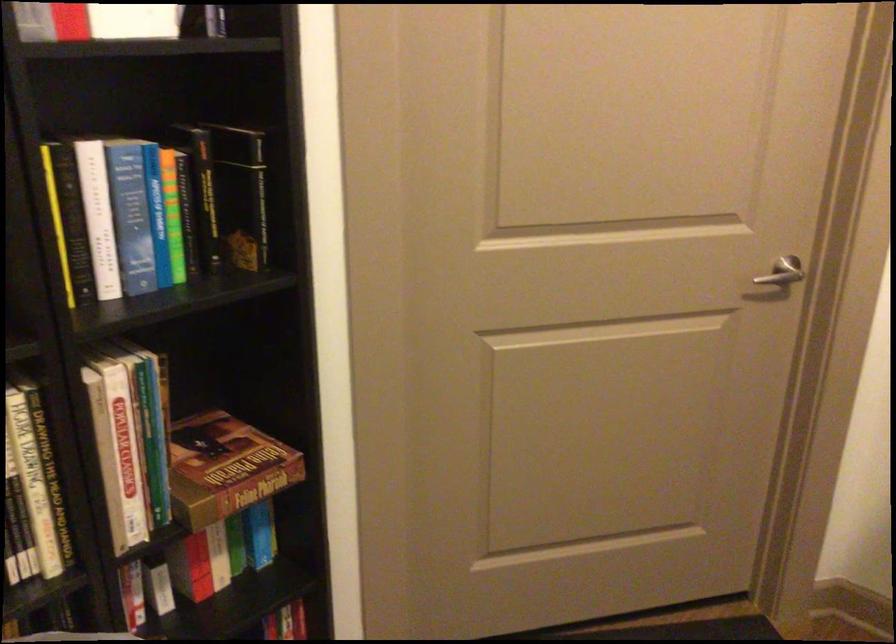
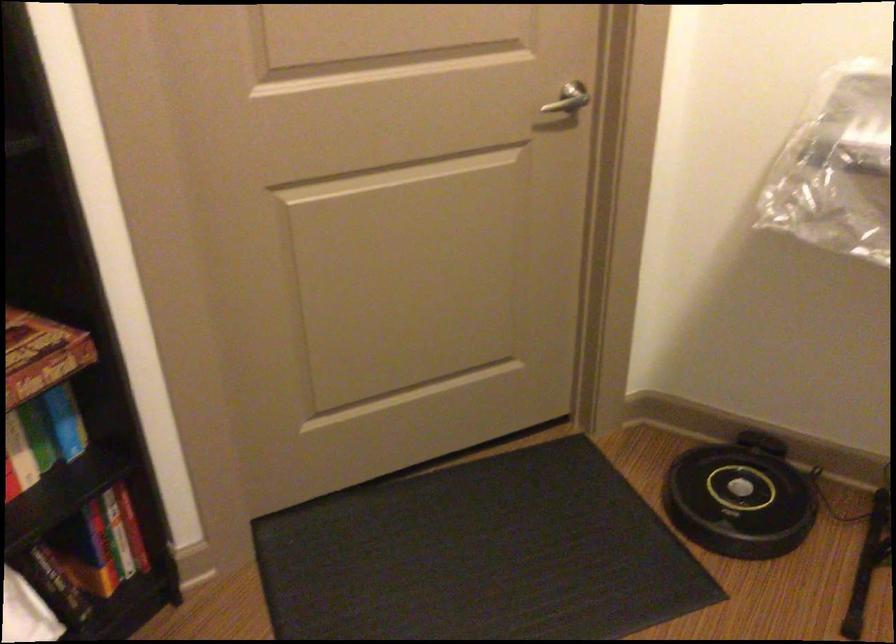
Question: The images are taken continuously from a first-person perspective. In which direction is your viewpoint rotating?

Choices:
 (A) Left
 (B) Right
 (C) Up
 (D) Down

Answer: (B)